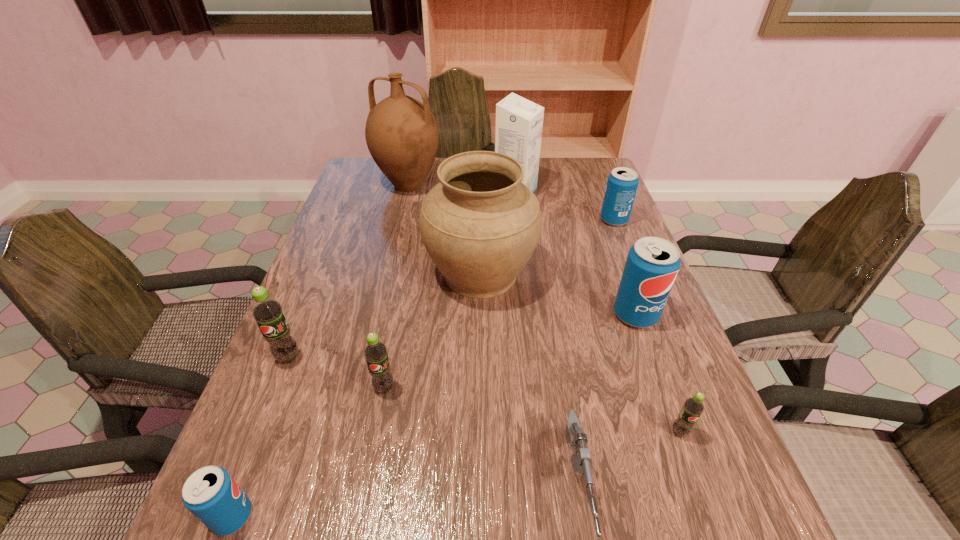
At what (x,y) coordinates should I click in order to perform the action: click on pitcher. Please return your answer as a coordinate pair (x, y). Looking at the image, I should click on (401, 133).

Find the location of a particular element. Image resolution: width=960 pixels, height=540 pixels. brown pitcher is located at coordinates (401, 133).

The width and height of the screenshot is (960, 540). In order to click on carton in this screenshot , I will do `click(519, 122)`.

Find the location of a particular element. The height and width of the screenshot is (540, 960). urn is located at coordinates (480, 224).

Locate an element on the screen. the biggest blue soda can is located at coordinates (652, 264).

The image size is (960, 540). Identify the location of the second farthest blue soda can. (652, 264).

This screenshot has width=960, height=540. I want to click on the fourth nearest soda can, so click(267, 311).

Where is `the fifth nearest object`? the fifth nearest object is located at coordinates (267, 311).

Find the location of a particular element. The width and height of the screenshot is (960, 540). the seventh farthest object is located at coordinates (375, 352).

This screenshot has height=540, width=960. I want to click on the fourth soda can from right to left, so click(x=375, y=352).